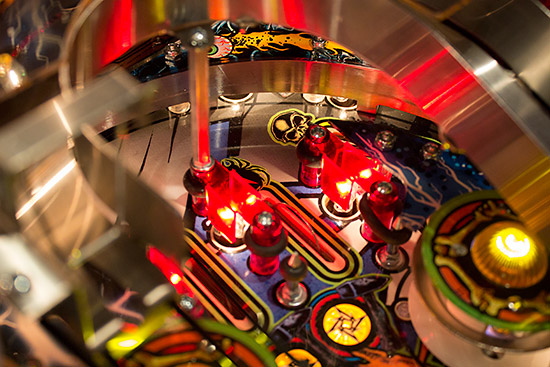
Locate an element on the screen. silver knob is located at coordinates (197, 32).